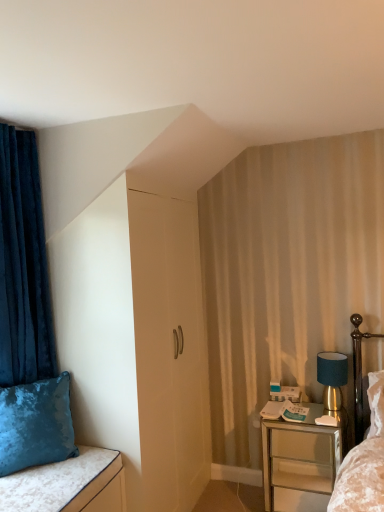
Question: From the image's perspective, relative to velvet blue pillow at lower left, is metallic silver nightstand at lower right above or below?

Choices:
 (A) below
 (B) above

Answer: (A)

Question: Looking at their shapes, would you say metallic silver nightstand at lower right is wider or thinner than velvet blue pillow at lower left?

Choices:
 (A) wide
 (B) thin

Answer: (A)

Question: Which is farther from the teal fabric lampshade at right?

Choices:
 (A) velvet blue curtain at left
 (B) velvet cushion at lower left
 (C) velvet blue pillow at lower left
 (D) metallic silver nightstand at lower right

Answer: (A)

Question: Which is nearer to the velvet blue curtain at left?

Choices:
 (A) metallic silver nightstand at lower right
 (B) velvet blue pillow at lower left
 (C) teal fabric lampshade at right
 (D) velvet cushion at lower left

Answer: (B)